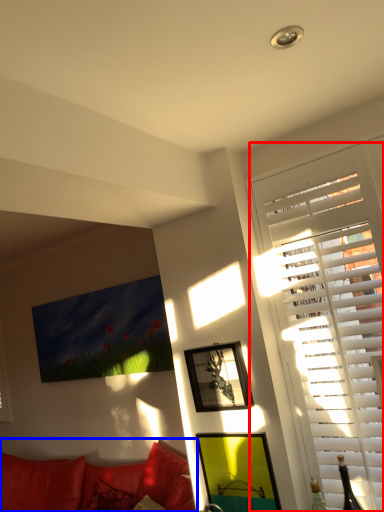
Question: Which object appears closest to the camera in this image, window (highlighted by a red box) or studio couch (highlighted by a blue box)?

Choices:
 (A) window
 (B) studio couch

Answer: (A)